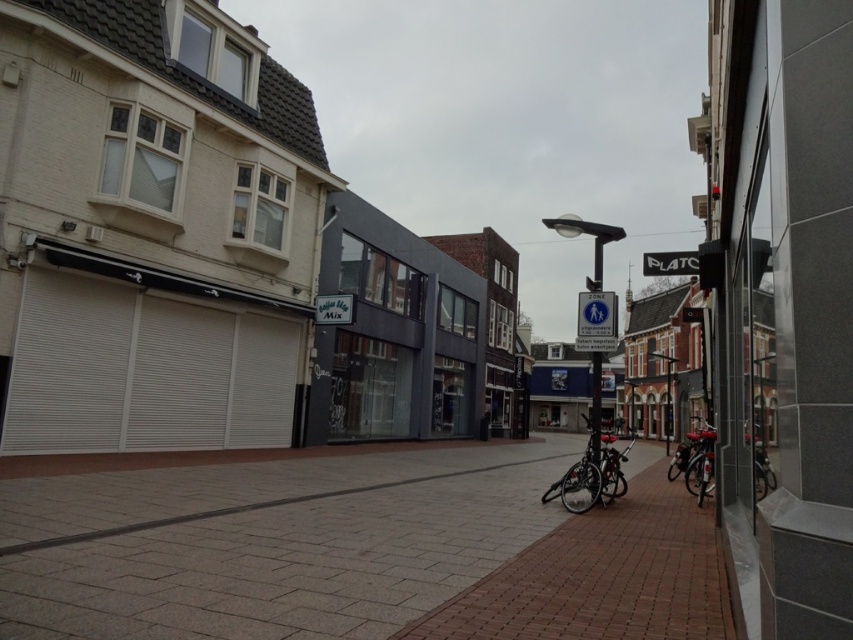
You are a delivery person standing at the edge of the brick pavement at center. You need to deliver a package to a customer who is 2.5 meters away from you. Can you reach them without stepping onto the brick pavement?

The brick pavement at center is 3.25 meters away from the viewer. Since the customer is only 2.5 meters away, you can reach them without stepping onto the brick pavement.

You are standing on the pedestrian walkway in the urban street scene. You want to place a small potted plant exactly at the center of the brick pavement at center. According to the scene description, where should you place the potted plant?

The brick pavement at center should have the potted plant placed at its geometric center, which corresponds to the 2D coordinates provided in the scene description at point (358,550).

You are standing on the pedestrian walkway in the urban street scene. There are two points marked on the image. The first point is at coordinates point (x=386, y=492) and the second point is at point (x=606, y=476). Which of these two points is closer to you?

Point (x=386, y=492) is further to the camera than point (x=606, y=476), so the point closer to you is point (x=606, y=476).